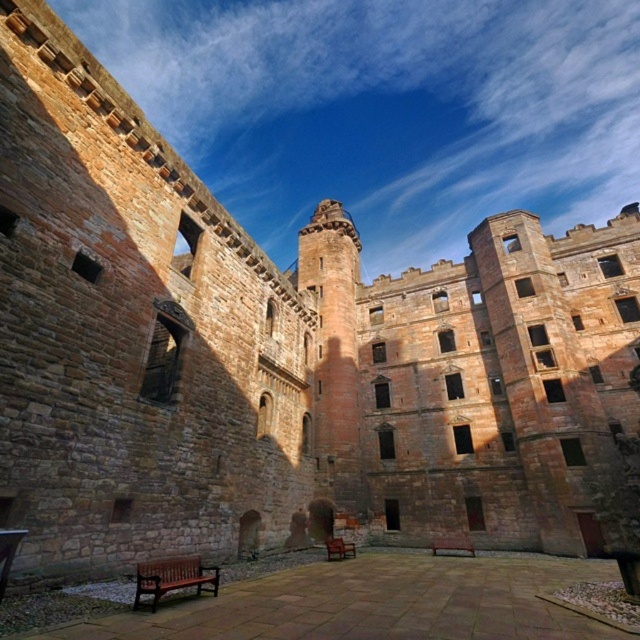
Question: Which point appears farthest from the camera in this image?

Choices:
 (A) (176, 576)
 (B) (371, 630)
 (C) (444, 538)
 (D) (353, 545)

Answer: (C)

Question: Which point is closer to the camera?

Choices:
 (A) (348, 545)
 (B) (134, 602)
 (C) (444, 544)

Answer: (B)

Question: Which object is the farthest from the brown wooden bench at lower center?

Choices:
 (A) brown wooden bench at lower left
 (B) brown wooden bench at center
 (C) wooden bench at center

Answer: (B)

Question: Where is brown wooden bench at lower center located in relation to wooden bench at center in the image?

Choices:
 (A) above
 (B) below

Answer: (A)

Question: Is brown wooden bench at lower left behind wooden bench at center?

Choices:
 (A) no
 (B) yes

Answer: (A)

Question: Is brown wooden bench at lower center to the right of brown wooden bench at center from the viewer's perspective?

Choices:
 (A) no
 (B) yes

Answer: (A)